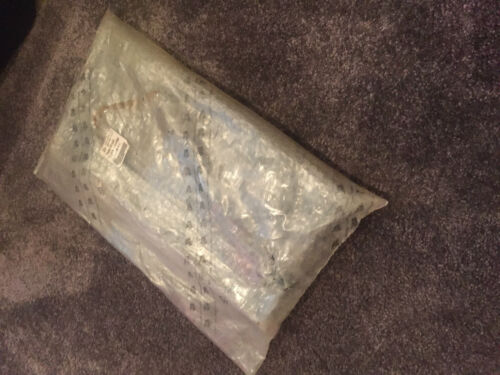
I want to click on sticker, so click(112, 151).